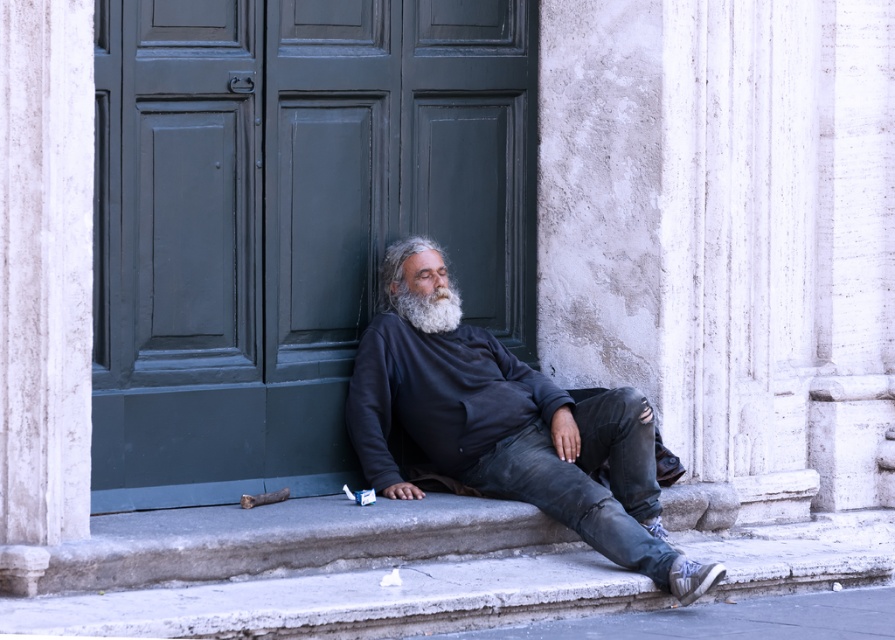
Question: Which object appears farthest from the camera in this image?

Choices:
 (A) white matte beard at center
 (B) dark blue sweatshirt at center

Answer: (A)

Question: Does dark blue sweatshirt at center have a larger size compared to white matte beard at center?

Choices:
 (A) no
 (B) yes

Answer: (B)

Question: Which of the following is the closest to the observer?

Choices:
 (A) white matte beard at center
 (B) dark blue sweatshirt at center
 (C) green matte door at center

Answer: (B)

Question: Does green matte door at center lie behind dark blue sweatshirt at center?

Choices:
 (A) yes
 (B) no

Answer: (A)

Question: Which of the following is the farthest from the observer?

Choices:
 (A) dark blue sweatshirt at center
 (B) green matte door at center

Answer: (B)

Question: Considering the relative positions of green matte door at center and dark blue sweatshirt at center in the image provided, where is green matte door at center located with respect to dark blue sweatshirt at center?

Choices:
 (A) below
 (B) above

Answer: (B)